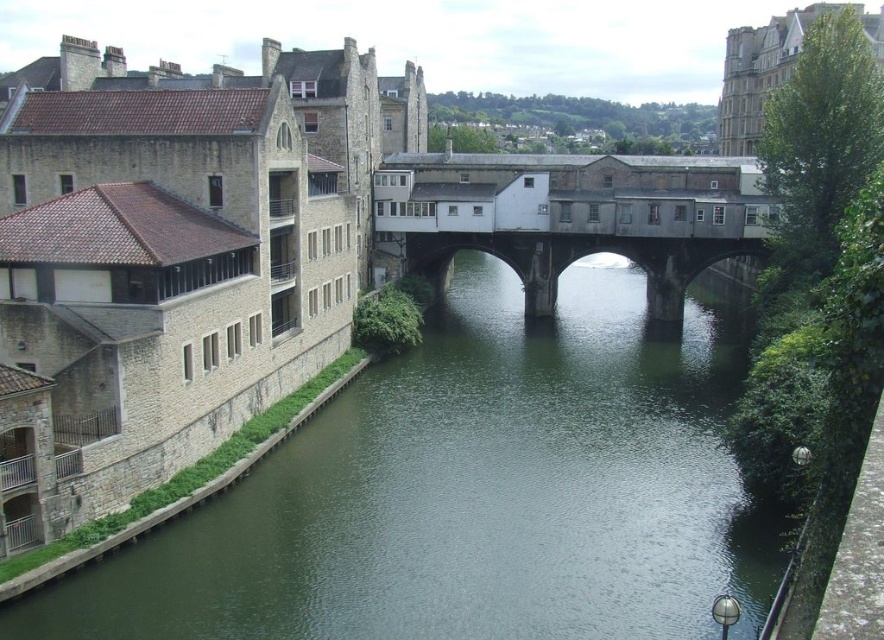
Question: Which point appears closest to the camera in this image?

Choices:
 (A) (634, 540)
 (B) (547, 243)

Answer: (A)

Question: Is green stone river at center positioned at the back of concrete bridge at center?

Choices:
 (A) yes
 (B) no

Answer: (B)

Question: Which object appears farthest from the camera in this image?

Choices:
 (A) concrete bridge at center
 (B) green stone river at center

Answer: (A)

Question: Among these points, which one is nearest to the camera?

Choices:
 (A) (423, 362)
 (B) (627, 257)

Answer: (A)

Question: Can you confirm if green stone river at center is positioned to the left of concrete bridge at center?

Choices:
 (A) yes
 (B) no

Answer: (A)

Question: Considering the relative positions of green stone river at center and concrete bridge at center in the image provided, where is green stone river at center located with respect to concrete bridge at center?

Choices:
 (A) right
 (B) left

Answer: (B)